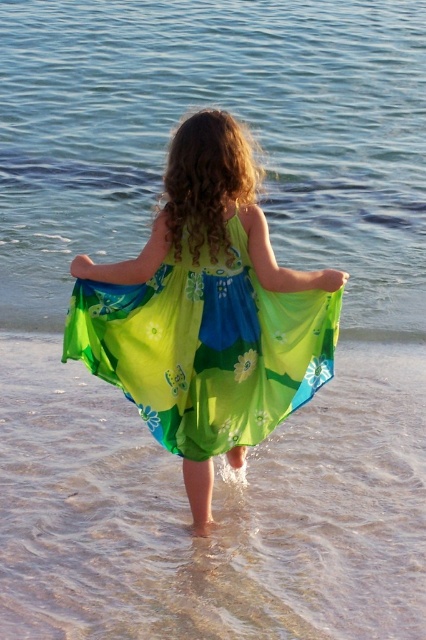
Question: Among these objects, which one is nearest to the camera?

Choices:
 (A) green sheer dress at center
 (B) translucent blue water at center

Answer: (A)

Question: Is translucent blue water at center further to camera compared to translucent sand at lower center?

Choices:
 (A) yes
 (B) no

Answer: (A)

Question: Can you confirm if translucent sand at lower center is thinner than green sheer dress at center?

Choices:
 (A) yes
 (B) no

Answer: (B)

Question: Among these points, which one is farthest from the camera?

Choices:
 (A) (54, 92)
 (B) (175, 369)

Answer: (A)

Question: Which point is farther to the camera?

Choices:
 (A) (77, 333)
 (B) (13, 637)
 (C) (172, 65)

Answer: (C)

Question: Considering the relative positions of translucent blue water at center and translucent sand at lower center in the image provided, where is translucent blue water at center located with respect to translucent sand at lower center?

Choices:
 (A) right
 (B) left

Answer: (B)